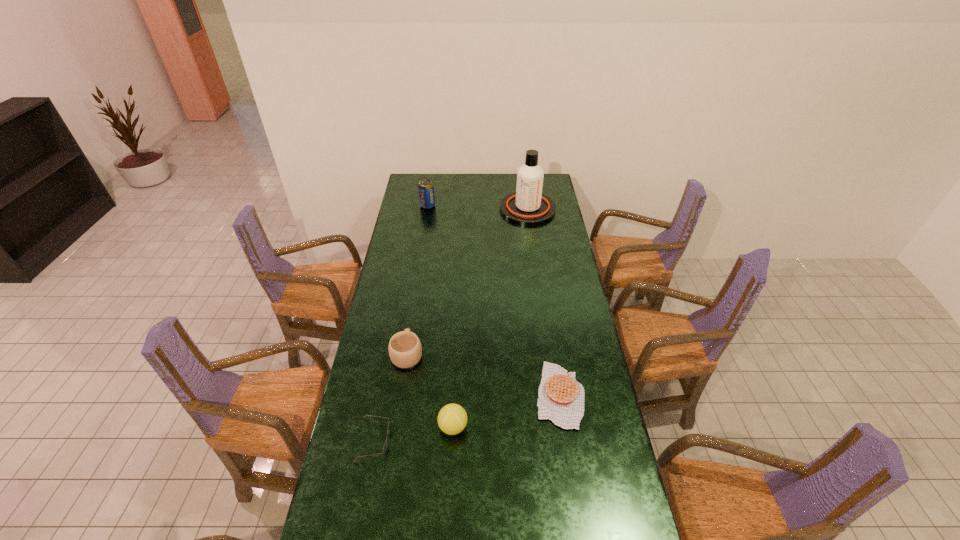
Identify the location of object that is at the far right corner. The height and width of the screenshot is (540, 960). 528,206.

Find the location of a particular element. The width and height of the screenshot is (960, 540). free location at the far edge is located at coordinates (497, 176).

In the image, there is a desktop. Where is `free space at the left edge`? free space at the left edge is located at coordinates (402, 226).

Identify the location of vacant space at the right edge. (587, 407).

You are a GUI agent. You are given a task and a screenshot of the screen. Output one action in this format:
    pyautogui.click(x=<x>, y=<y>)
    Task: Click on the free space at the far left corner of the desktop
    
    Given the screenshot: What is the action you would take?
    pyautogui.click(x=404, y=191)

Image resolution: width=960 pixels, height=540 pixels. Identify the location of vacant region at the far right corner of the desktop. (545, 194).

I want to click on vacant area that lies between the mug and the pie, so click(x=484, y=374).

The width and height of the screenshot is (960, 540). What are the coordinates of `vacant space that's between the sunglasses and the cleansing agent` in the screenshot? It's located at (450, 325).

The width and height of the screenshot is (960, 540). I want to click on free space between the second tallest object and the sunglasses, so coord(400,323).

At what (x,y) coordinates should I click in order to perform the action: click on vacant space in between the third object from right to left and the second tallest object. Please return your answer as a coordinate pair (x, y). Image resolution: width=960 pixels, height=540 pixels. Looking at the image, I should click on (441, 316).